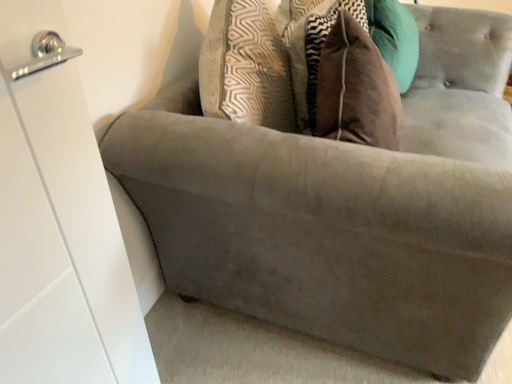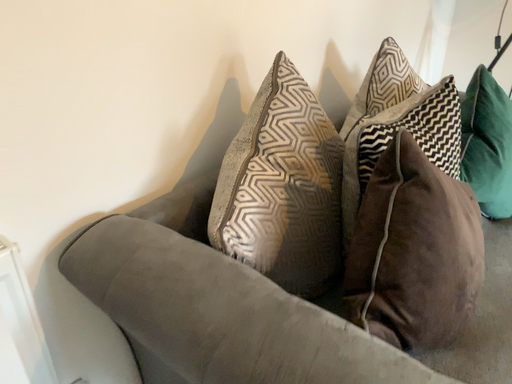
Question: How did the camera likely rotate when shooting the video?

Choices:
 (A) rotated downward
 (B) rotated upward

Answer: (B)